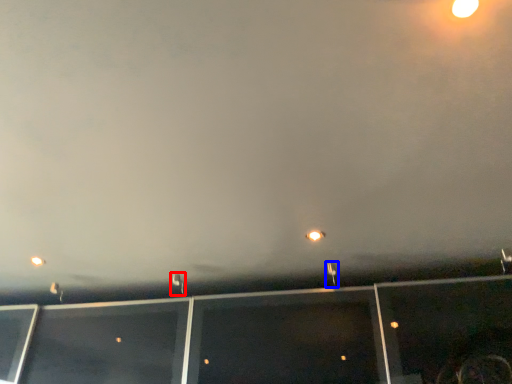
Question: Which object appears farthest to the camera in this image, street light (highlighted by a red box) or street light (highlighted by a blue box)?

Choices:
 (A) street light
 (B) street light

Answer: (A)